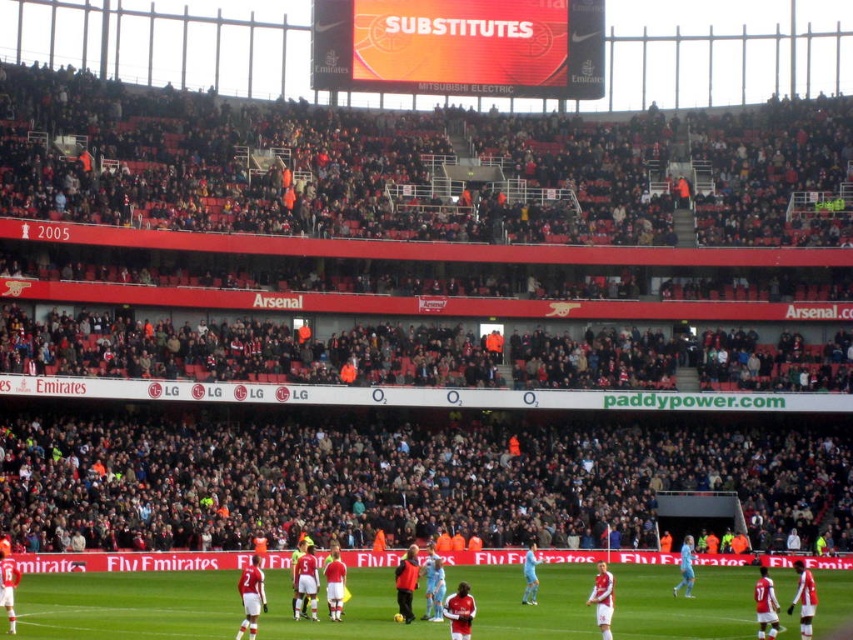
You are a photographer positioned at the edge of the field. You want to take a photo that includes both the green grass football field at center and the red matte scoreboard at upper center. Which object should appear larger in the photo?

The green grass football field at center will appear larger in the photo because it is closer to the photographer than the red matte scoreboard at upper center, which is further away.

You are a drone operator trying to capture aerial footage of the football stadium. You have two points marked on your screen for camera positioning. The first point is at coordinate point(142, 602) and the second at point(469, 77). From the perspective of someone sitting in the stadium, which point is closer to the field?

Point(142, 602) is in front of point(469, 77), so from the perspective of someone sitting in the stadium, point(142, 602) is closer to the field.

You are a drone operator planning to capture aerial footage of the football match. The green grass football field at center is your primary focus, but you also need to include the red matte scoreboard at upper center in the shot. Given that your drone can capture a maximum horizontal distance of 40 meters in its field of view, will you be able to frame both objects in a single shot?

The green grass football field at center and red matte scoreboard at upper center are 41.81 meters apart from each other. Since the drone can only capture up to 40 meters horizontally, the distance between them exceeds the maximum range. Therefore, you will not be able to frame both objects in a single shot.